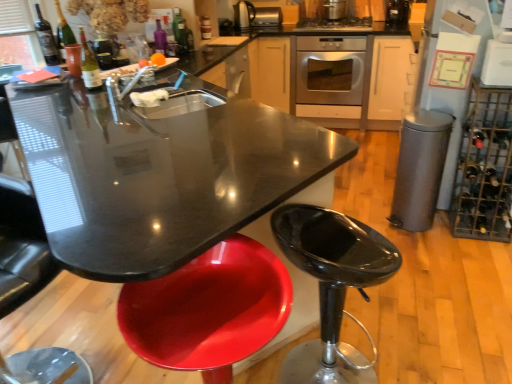
Find the location of a particular element. The width and height of the screenshot is (512, 384). unoccupied space behind metallic gray trash can at right, the 4th appliance when ordered from left to right is located at coordinates (377, 203).